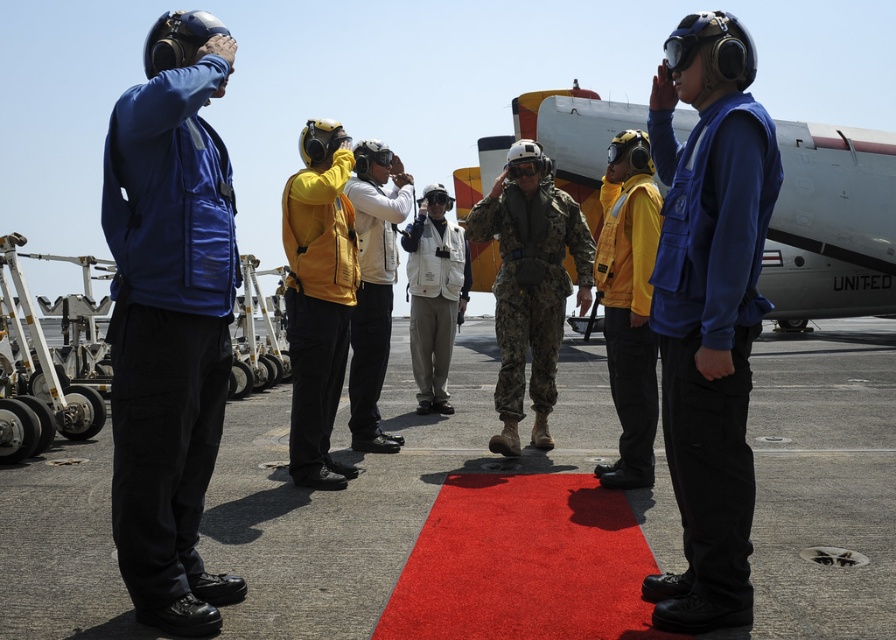
Looking at this image, you are standing at the point labeled point (x=130, y=164) on the aircraft carrier deck. You want to take a photo of the central figure who is dressed in military camouflage attire. The camera you are using has a focal length of 50mm and a sensor size of 24mm x 36mm. If the central figure is 1.8 meters tall, what is the minimum distance you need to be from the point to ensure the entire figure fits within the camera frame?

To determine the minimum distance required, we can use the formula for field of view. The vertical field of view is calculated using arctan sensor height divided by focal length. Sensor height is 24mm, focal length is 50mm, so arctan 24 divided by 50 equals approximately 27.6 degrees. The half of this angle is 13.8 degrees. The central figure is 1.8 meters tall, so half the height is 0.9 meters. Using trigonometry, the distance is 0.9 divided by tan 13.8 degrees, which is approximately 5.5 meters. Since the

Based on the photo, you are standing on an aircraft carrier deck with several individuals saluting a central figure in camouflage attire. There is a point marked at coordinates point (154, 332). If you want to place a 10 feet long safety barrier from your current position to that point, will it fit without exceeding the available space?

The point (154, 332) is 9.45 feet from the camera, so placing a 10 feet long safety barrier from your current position to that point will exceed the available space by 0.55 feet.

You are a photographer on an aircraft carrier deck. You need to capture a photo of the blue fabric helmet at left and the white fabric jacket at center. If your camera can only focus on objects wider than 30 cm, will both items be in focus?

The blue fabric helmet at left is wider than the white fabric jacket at center. Since the blue fabric helmet at left is wider than 30 cm, it will be in focus. However, the width of the white fabric jacket at center is not specified, so we cannot confirm if it meets the 30 cm requirement. Therefore, only the blue fabric helmet at left is guaranteed to be in focus.